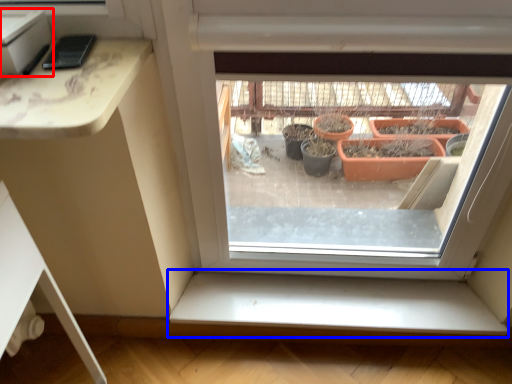
Question: Which of the following is the farthest to the observer, window box (highlighted by a red box) or window sill (highlighted by a blue box)?

Choices:
 (A) window box
 (B) window sill

Answer: (B)